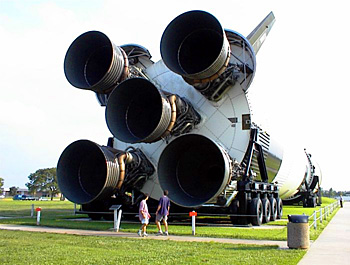
You are a GUI agent. You are given a task and a screenshot of the screen. Output one action in this format:
    pyautogui.click(x=<x>, y=<y>)
    Task: Click on the bin
    This screenshot has width=350, height=265.
    Given the screenshot: What is the action you would take?
    pyautogui.click(x=301, y=232)